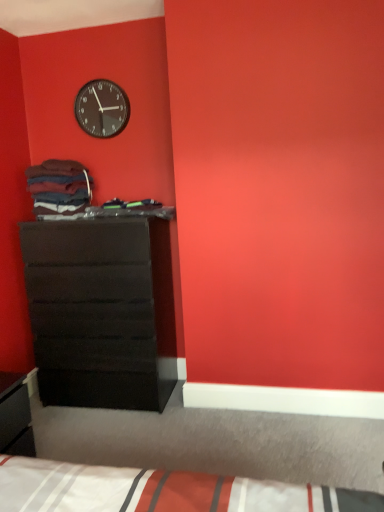
Question: In the image, is matte black chest of drawers at left positioned in front of or behind white striped fabric bed at lower center?

Choices:
 (A) behind
 (B) front

Answer: (A)

Question: Would you say matte black chest of drawers at left is inside or outside white striped fabric bed at lower center?

Choices:
 (A) inside
 (B) outside

Answer: (B)

Question: Based on their relative distances, which object is nearer to the matte black clock at upper left?

Choices:
 (A) white striped fabric bed at lower center
 (B) matte black chest of drawers at left

Answer: (B)

Question: Which object is positioned closest to the white striped fabric bed at lower center?

Choices:
 (A) matte black chest of drawers at left
 (B) matte black clock at upper left

Answer: (A)